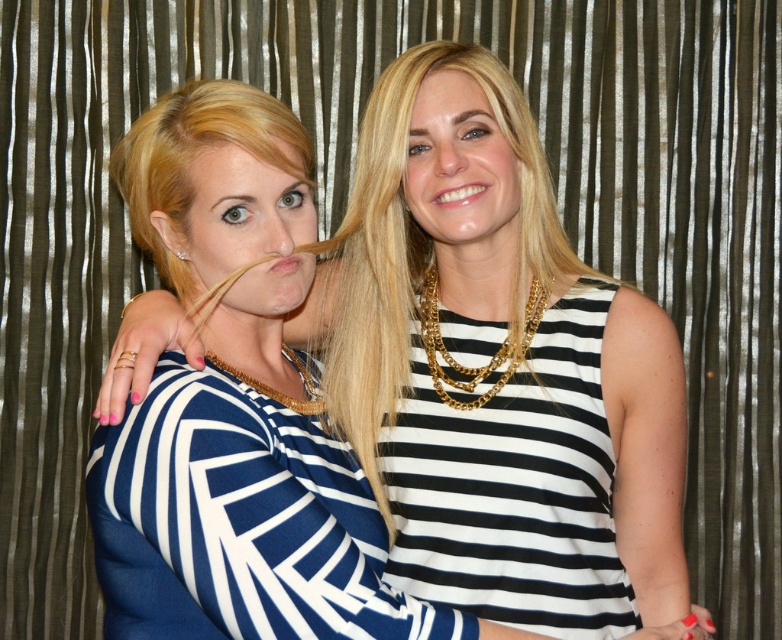
Which is below, blue striped dress at center or black and white striped dress at center?

black and white striped dress at center is below.

Image resolution: width=782 pixels, height=640 pixels. Describe the element at coordinates (497, 369) in the screenshot. I see `blue striped dress at center` at that location.

Between point (386, 364) and point (572, 337), which one is positioned in front?

Point (572, 337)

Image resolution: width=782 pixels, height=640 pixels. Identify the location of blue striped dress at center. (497, 369).

Does navy blue jersey dress at center appear under black and white striped dress at center?

Indeed, navy blue jersey dress at center is positioned under black and white striped dress at center.

Between navy blue jersey dress at center and black and white striped dress at center, which one is positioned lower?

Positioned lower is navy blue jersey dress at center.

Locate an element on the screen. navy blue jersey dress at center is located at coordinates (239, 522).

Is blue striped dress at center to the left of navy blue jersey dress at center from the viewer's perspective?

No, blue striped dress at center is not to the left of navy blue jersey dress at center.

The height and width of the screenshot is (640, 782). What are the coordinates of `blue striped dress at center` in the screenshot? It's located at (497, 369).

Identify the location of blue striped dress at center. (497, 369).